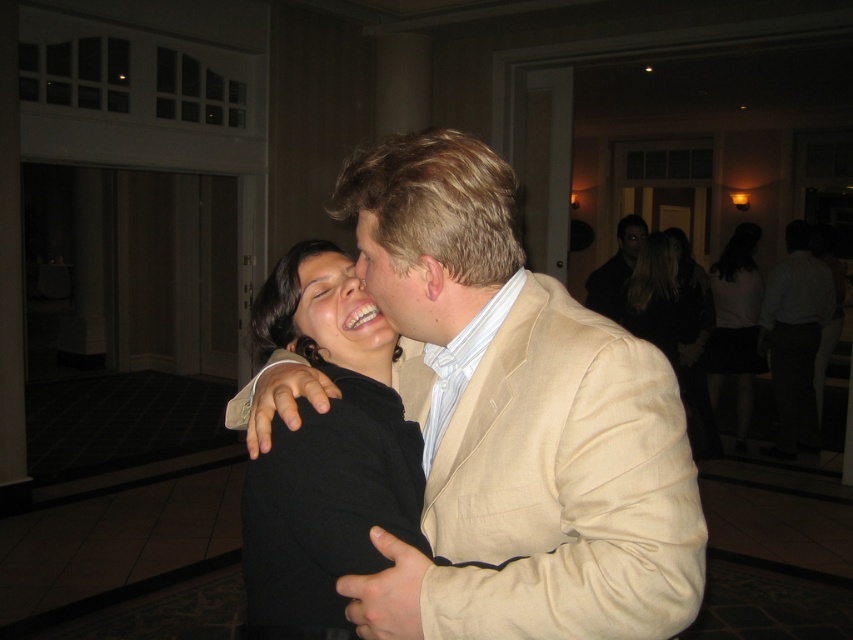
Is black soft fabric at center closer to camera compared to black cotton shirt at upper right?

That is True.

Measure the distance between black soft fabric at center and camera.

36.56 inches

Is point (347, 548) positioned in front of point (602, 285)?

Yes, it is.

You are a GUI agent. You are given a task and a screenshot of the screen. Output one action in this format:
    pyautogui.click(x=<x>, y=<y>)
    Task: Click on the black soft fabric at center
    This screenshot has height=640, width=853.
    Given the screenshot: What is the action you would take?
    pyautogui.click(x=326, y=452)

Is black soft fabric at center bigger than black fabric dress at center?

No, black soft fabric at center is not bigger than black fabric dress at center.

Between point (357, 304) and point (645, 301), which one is positioned behind?

The point (645, 301) is more distant.

Locate an element on the screen. The image size is (853, 640). black soft fabric at center is located at coordinates (326, 452).

Which is below, beige linen suit at center or beige linen suit at right?

Positioned lower is beige linen suit at center.

Which is behind, point (486, 500) or point (809, 228)?

The point (809, 228) is more distant.

Which is in front, point (613, 577) or point (790, 298)?

Point (613, 577) is more forward.

Locate an element on the screen. The image size is (853, 640). beige linen suit at center is located at coordinates (515, 422).